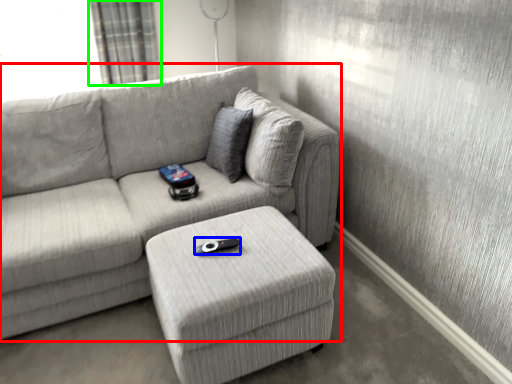
Question: Which object is positioned closest to studio couch (highlighted by a red box)? Select from remote (highlighted by a blue box) and curtain (highlighted by a green box).

Choices:
 (A) remote
 (B) curtain

Answer: (A)